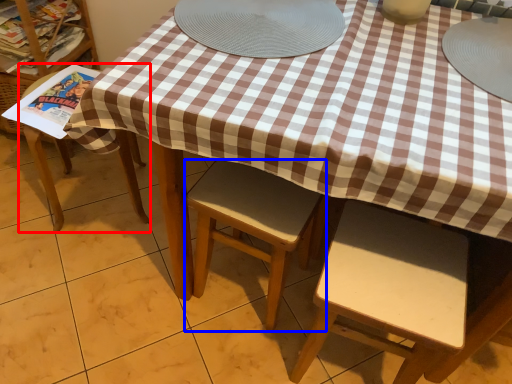
Question: Among these objects, which one is nearest to the camera, chair (highlighted by a red box) or chair (highlighted by a blue box)?

Choices:
 (A) chair
 (B) chair

Answer: (B)